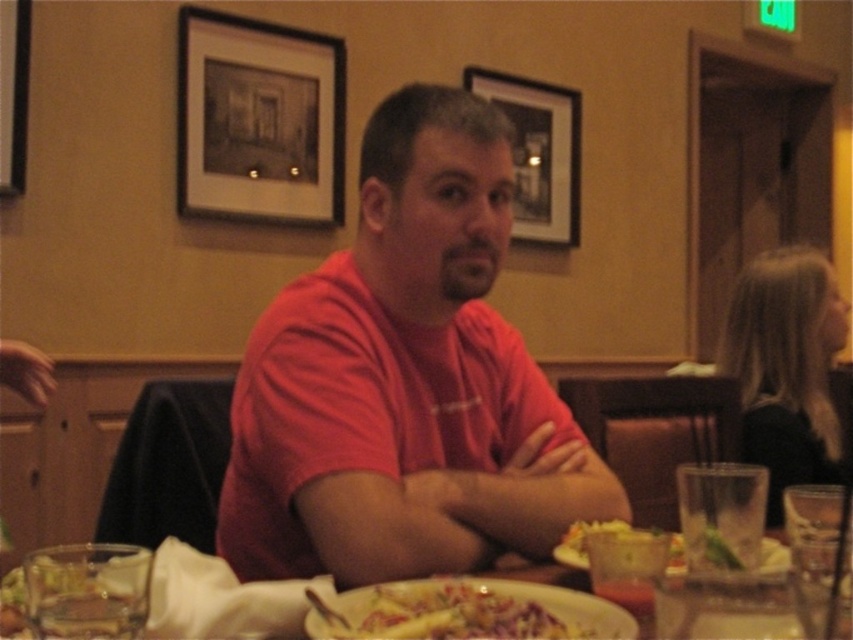
Is black matte picture frame at upper center to the left of shiny plastic fork at lower center from the viewer's perspective?

Correct, you'll find black matte picture frame at upper center to the left of shiny plastic fork at lower center.

This screenshot has height=640, width=853. I want to click on black matte picture frame at upper center, so click(258, 120).

At what (x,y) coordinates should I click in order to perform the action: click on black matte picture frame at upper center. Please return your answer as a coordinate pair (x, y). Looking at the image, I should click on (258, 120).

Is black matte picture frame at upper center bigger than clear glass at lower left?

Correct, black matte picture frame at upper center is larger in size than clear glass at lower left.

Is black matte picture frame at upper center thinner than clear glass at lower left?

Incorrect, black matte picture frame at upper center's width is not less than clear glass at lower left's.

Measure the distance between black matte picture frame at upper center and camera.

black matte picture frame at upper center is 8.01 feet from camera.

Where is `black matte picture frame at upper center`? black matte picture frame at upper center is located at coordinates (258, 120).

Between matte red shirt at center and matte black picture frame at upper center, which one appears on the left side from the viewer's perspective?

matte red shirt at center is more to the left.

Which is in front, point (396, 132) or point (552, 147)?

Point (396, 132) is in front.

The width and height of the screenshot is (853, 640). I want to click on matte red shirt at center, so point(401,378).